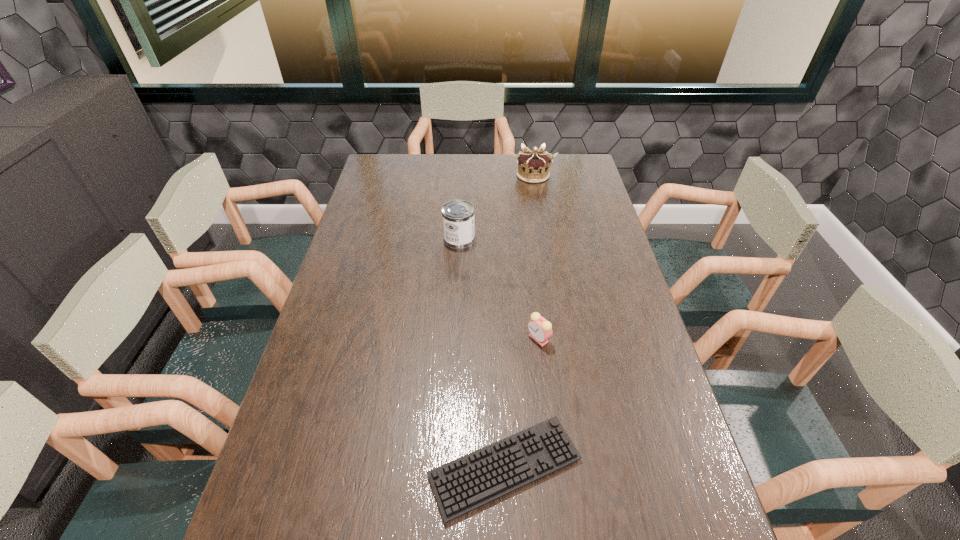
In order to click on the farthest object in this screenshot , I will do `click(533, 166)`.

Where is `the third nearest object`? the third nearest object is located at coordinates (457, 215).

Where is `the second nearest object`? the second nearest object is located at coordinates (540, 329).

You are a GUI agent. You are given a task and a screenshot of the screen. Output one action in this format:
    pyautogui.click(x=<x>, y=<y>)
    Task: Click on the alarm clock
    This screenshot has width=960, height=540.
    Given the screenshot: What is the action you would take?
    click(540, 329)

This screenshot has height=540, width=960. In order to click on the shortest object in this screenshot , I will do `click(473, 480)`.

This screenshot has height=540, width=960. I want to click on computer keyboard, so click(473, 480).

This screenshot has width=960, height=540. In order to click on vacant space located on the back of the crown in this screenshot , I will do `click(530, 156)`.

I want to click on vacant space located on the back of the can, so click(x=462, y=192).

Where is `free space located 0.150m on the face of the second nearest object`? The width and height of the screenshot is (960, 540). free space located 0.150m on the face of the second nearest object is located at coordinates (473, 339).

The width and height of the screenshot is (960, 540). What are the coordinates of `vacant space located 0.120m on the face of the second nearest object` in the screenshot? It's located at (484, 339).